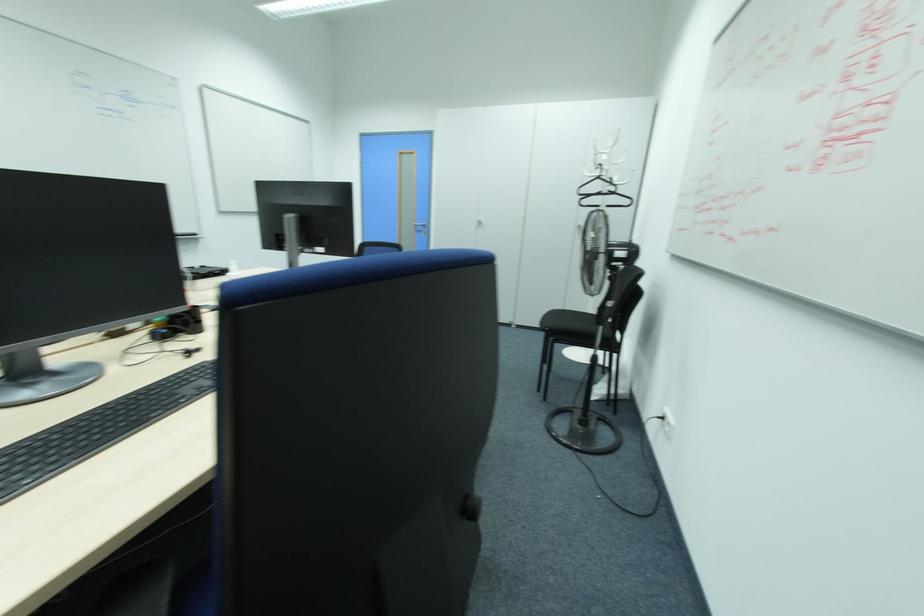
This screenshot has height=616, width=924. Identify the location of white power outlet. (667, 419).